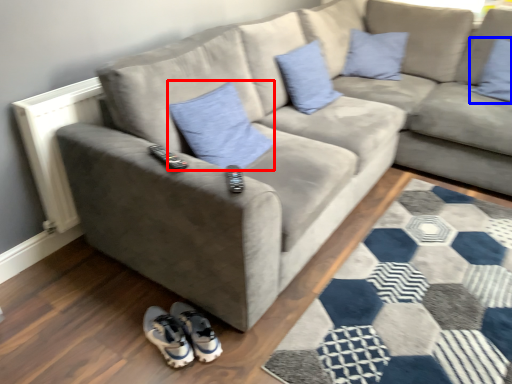
Question: Which point is closer to the camera, pillow (highlighted by a red box) or pillow (highlighted by a blue box)?

Choices:
 (A) pillow
 (B) pillow

Answer: (A)